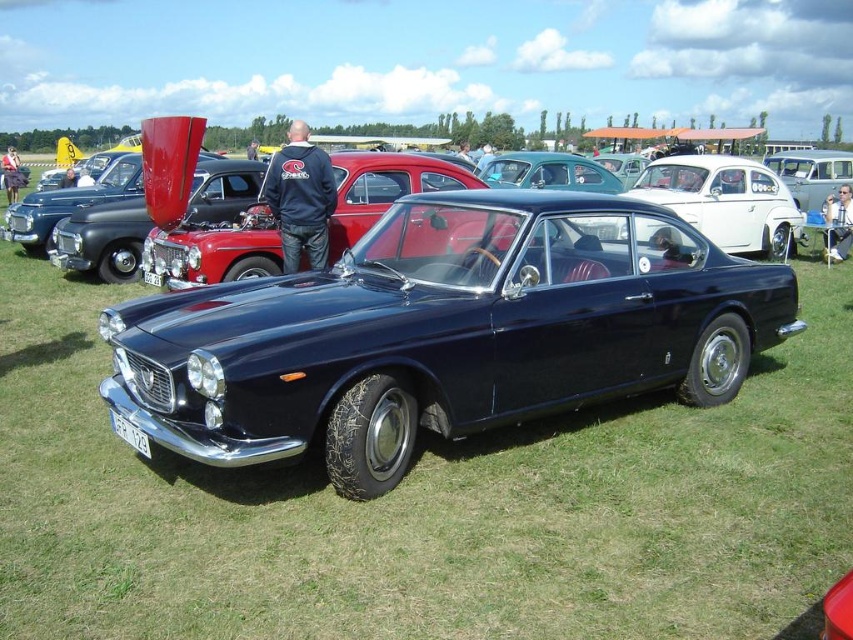
You are standing at the position of the point at coordinates point (149, 276) and want to walk towards the point at coordinates point (117, 435). Which direction should you face to move towards it?

Point (117, 435) is in front of point (149, 276), so you should face forward to move towards it.

You are standing at the center of the grassy field and see the point marked at coordinates (x=445, y=332). What object is located at that point?

The point at coordinates (x=445, y=332) indicates the shiny dark blue car at center.

You are standing in front of the vintage car show and want to take a photo that includes both the dark blue vintage sports car and the red car with its hood open. The points you need to focus on are point (503, 352) and point (312, 253). Which point should you focus on to ensure both cars are in sharp focus?

You should focus on point (503, 352) because it is closer to the camera than point (312, 253), ensuring both cars are within the depth of field.